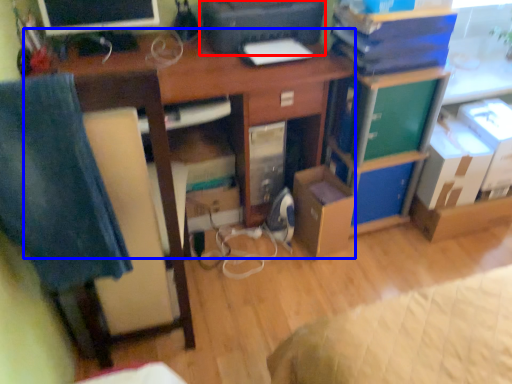
Question: Which object appears closest to the camera in this image, printer (highlighted by a red box) or desk (highlighted by a blue box)?

Choices:
 (A) printer
 (B) desk

Answer: (B)